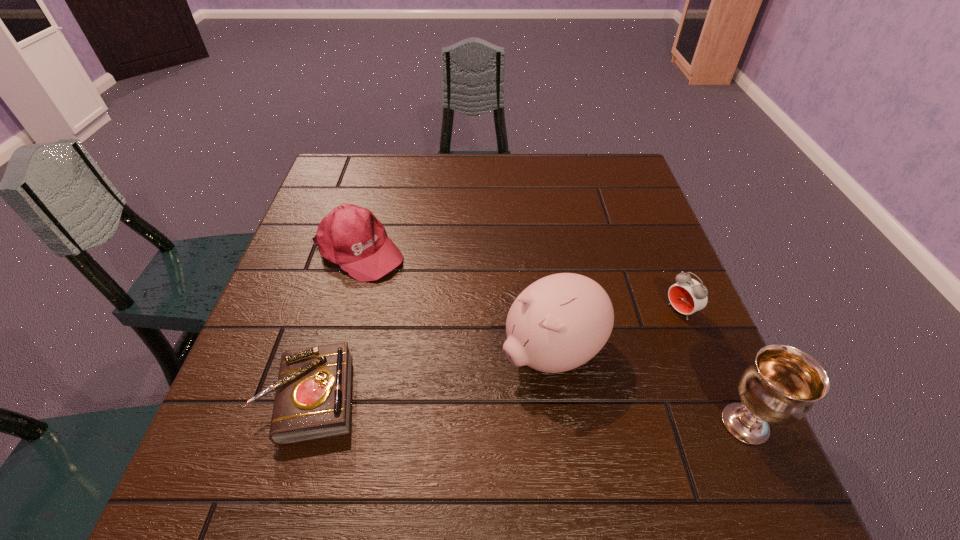
Where is `free space on the desktop that is between the diary and the chalice and is positioned at the front of the baseball cap with the brim`? The width and height of the screenshot is (960, 540). free space on the desktop that is between the diary and the chalice and is positioned at the front of the baseball cap with the brim is located at coordinates (570, 413).

You are a GUI agent. You are given a task and a screenshot of the screen. Output one action in this format:
    pyautogui.click(x=<x>, y=<y>)
    Task: Click on the vacant spot on the desktop that is between the diary and the chalice and is positioned at the snout of the piggy bank
    The height and width of the screenshot is (540, 960).
    Given the screenshot: What is the action you would take?
    pyautogui.click(x=462, y=407)

This screenshot has width=960, height=540. I want to click on free space on the desktop that is between the shortest object and the chalice and is positioned on the face of the alarm clock, so click(x=507, y=409).